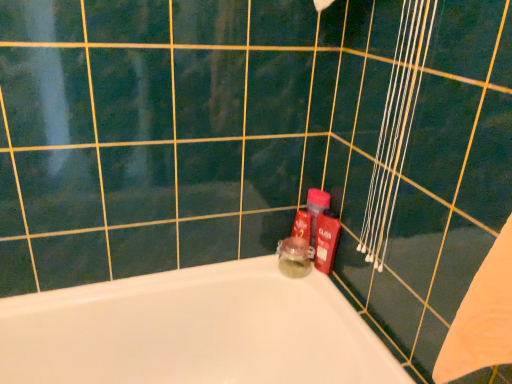
Question: Is white glossy bathtub at lower left outside of translucent glass jar at center, which is the 2th toiletry from right to left?

Choices:
 (A) yes
 (B) no

Answer: (A)

Question: Considering the relative sizes of white glossy bathtub at lower left and translucent glass jar at center, acting as the 1th toiletry starting from the left, in the image provided, is white glossy bathtub at lower left shorter than translucent glass jar at center, acting as the 1th toiletry starting from the left,?

Choices:
 (A) yes
 (B) no

Answer: (B)

Question: Does white glossy bathtub at lower left have a greater width compared to translucent glass jar at center, acting as the 1th toiletry starting from the left?

Choices:
 (A) yes
 (B) no

Answer: (A)

Question: Can you confirm if white glossy bathtub at lower left is taller than translucent glass jar at center, acting as the 1th toiletry starting from the left?

Choices:
 (A) no
 (B) yes

Answer: (B)

Question: Is white glossy bathtub at lower left directly adjacent to translucent glass jar at center, acting as the 1th toiletry starting from the left?

Choices:
 (A) no
 (B) yes

Answer: (A)

Question: Is shiny plastic bottle at right, marked as the 2th toiletry in a left-to-right arrangement, taller or shorter than white glossy bathtub at lower left?

Choices:
 (A) short
 (B) tall

Answer: (A)

Question: From a real-world perspective, is shiny plastic bottle at right, marked as the 2th toiletry in a left-to-right arrangement, above or below white glossy bathtub at lower left?

Choices:
 (A) below
 (B) above

Answer: (B)

Question: From the image's perspective, is shiny plastic bottle at right, marked as the 2th toiletry in a left-to-right arrangement, positioned above or below white glossy bathtub at lower left?

Choices:
 (A) above
 (B) below

Answer: (A)

Question: In the image, is shiny plastic bottle at right, which is the first toiletry in right-to-left order, positioned in front of or behind white glossy bathtub at lower left?

Choices:
 (A) behind
 (B) front

Answer: (A)

Question: Considering the positions of white glossy bathtub at lower left and shiny plastic bottle at right, which is the first toiletry in right-to-left order, in the image, is white glossy bathtub at lower left taller or shorter than shiny plastic bottle at right, which is the first toiletry in right-to-left order,?

Choices:
 (A) tall
 (B) short

Answer: (A)

Question: Is point (86, 347) closer or farther from the camera than point (325, 241)?

Choices:
 (A) farther
 (B) closer

Answer: (B)

Question: From a real-world perspective, is white glossy bathtub at lower left positioned above or below shiny plastic bottle at right, which is the first toiletry in right-to-left order?

Choices:
 (A) below
 (B) above

Answer: (A)

Question: From the image's perspective, relative to shiny plastic bottle at right, marked as the 2th toiletry in a left-to-right arrangement, is white glossy bathtub at lower left above or below?

Choices:
 (A) above
 (B) below

Answer: (B)

Question: Considering their positions, is white glossy bathtub at lower left located in front of or behind translucent glass jar at center, which is the 2th toiletry from right to left?

Choices:
 (A) behind
 (B) front

Answer: (B)

Question: Does point (146, 281) appear closer or farther from the camera than point (285, 238)?

Choices:
 (A) closer
 (B) farther

Answer: (A)